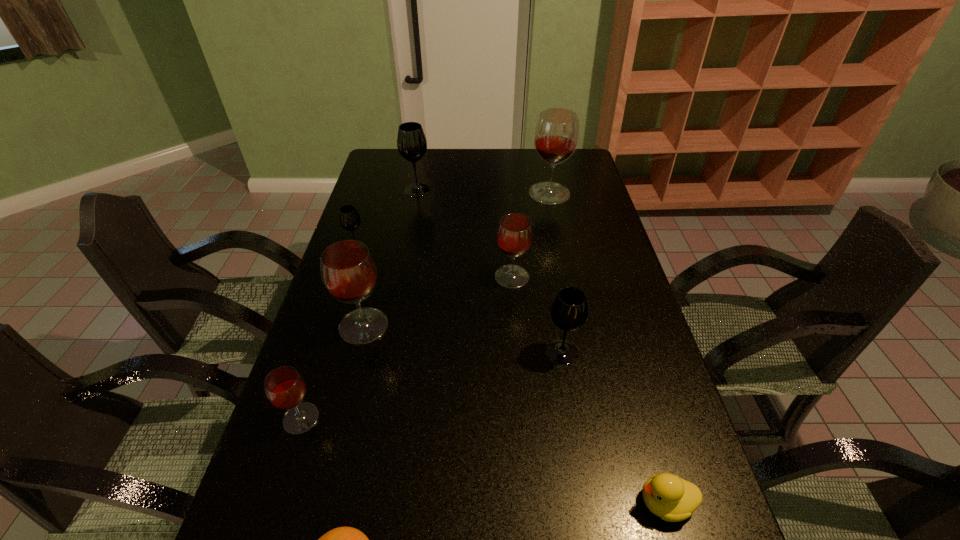
This screenshot has height=540, width=960. In order to click on unoccupied position between the third red wineglass from left to right and the second farthest gray wineglass in this screenshot , I will do `click(434, 262)`.

Locate an element on the screen. This screenshot has height=540, width=960. vacant area that lies between the fourth object from right to left and the second biggest red wineglass is located at coordinates (438, 301).

Identify the location of free space between the second farthest gray wineglass and the seventh farthest object. The width and height of the screenshot is (960, 540). (329, 333).

The width and height of the screenshot is (960, 540). Find the location of `vacant space in between the biggest red wineglass and the smallest red wineglass`. vacant space in between the biggest red wineglass and the smallest red wineglass is located at coordinates (425, 306).

Find the location of a particular element. Image resolution: width=960 pixels, height=540 pixels. empty space between the second nearest object and the rightmost gray wineglass is located at coordinates (613, 427).

Where is `the sixth closest object to the nearest red wineglass`? This screenshot has width=960, height=540. the sixth closest object to the nearest red wineglass is located at coordinates (673, 499).

You are a GUI agent. You are given a task and a screenshot of the screen. Output one action in this format:
    pyautogui.click(x=<x>, y=<y>)
    Task: Click on the closest object to the duckling
    Image resolution: width=960 pixels, height=540 pixels.
    Given the screenshot: What is the action you would take?
    pyautogui.click(x=569, y=311)

Point out which wineglass is positioned as the nearest to the nearest object. Please provide its 2D coordinates. Your answer should be formatted as a tuple, i.e. [(x, y)], where the tuple contains the x and y coordinates of a point satisfying the conditions above.

[(285, 388)]

Identify which wineglass is located as the fifth nearest to the fourth farthest wineglass. Please provide its 2D coordinates. Your answer should be formatted as a tuple, i.e. [(x, y)], where the tuple contains the x and y coordinates of a point satisfying the conditions above.

[(411, 141)]

Select which red wineglass appears as the closest to the tallest object. Please provide its 2D coordinates. Your answer should be formatted as a tuple, i.e. [(x, y)], where the tuple contains the x and y coordinates of a point satisfying the conditions above.

[(514, 236)]